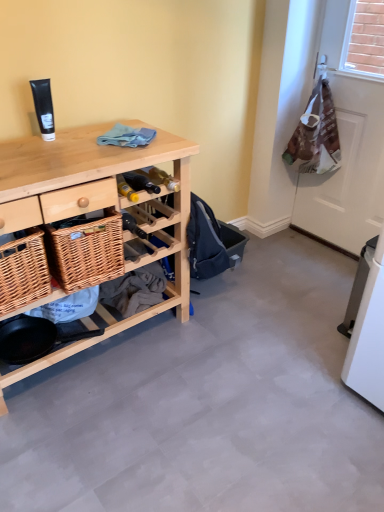
Identify the location of free space in front of black matte tube at upper left. The width and height of the screenshot is (384, 512). (48, 148).